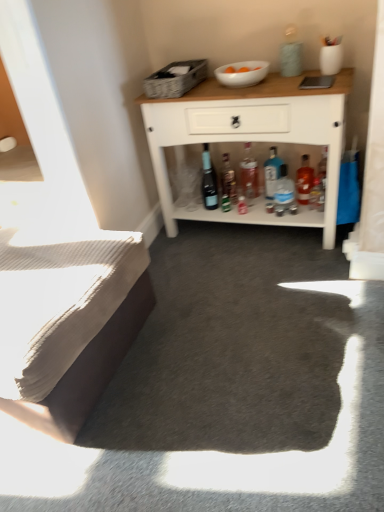
The height and width of the screenshot is (512, 384). I want to click on free space above woven fabric picnic basket at upper center (from a real-world perspective), so point(173,68).